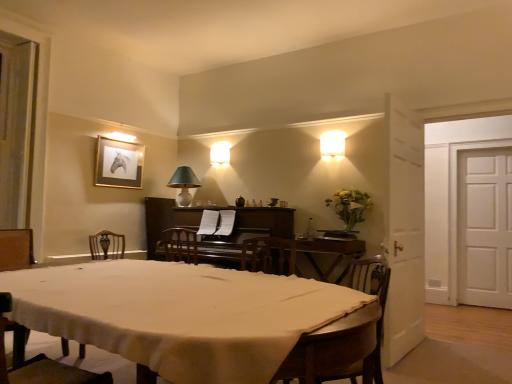
Question: Considering the positions of white cloth-covered table at center and matte white lampshade at upper right, which appears as the 3th lamp when viewed from the left, in the image, is white cloth-covered table at center wider or thinner than matte white lampshade at upper right, which appears as the 3th lamp when viewed from the left,?

Choices:
 (A) thin
 (B) wide

Answer: (B)

Question: From the image's perspective, relative to matte white lampshade at upper right, which is the first lamp from front to back, is white cloth-covered table at center above or below?

Choices:
 (A) below
 (B) above

Answer: (A)

Question: Estimate the real-world distances between objects in this image. Which object is closer to the wooden chair at lower left, marked as the first chair in a front-to-back arrangement?

Choices:
 (A) matte white lampshade at center, the 1th lamp viewed from the left
 (B) clear glass bottle at center
 (C) white matte door at right
 (D) matte green lampshade at upper center, the second lamp from the right
 (E) dark brown polished wood piano at center

Answer: (E)

Question: Estimate the real-world distances between objects in this image. Which object is farther from the wooden striped chair at lower right, the 1th chair from the back?

Choices:
 (A) clear glass bottle at center
 (B) matte white lampshade at center, the second lamp in the front-to-back sequence
 (C) matte green lampshade at upper center, the second lamp from the right
 (D) white matte door at right
 (E) wooden chair at lower left, marked as the first chair in a front-to-back arrangement

Answer: (D)